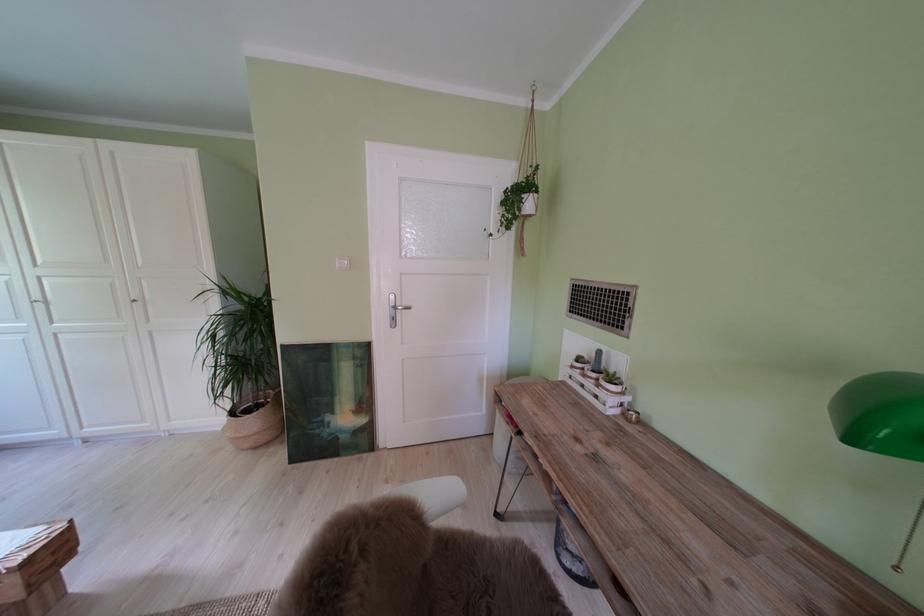
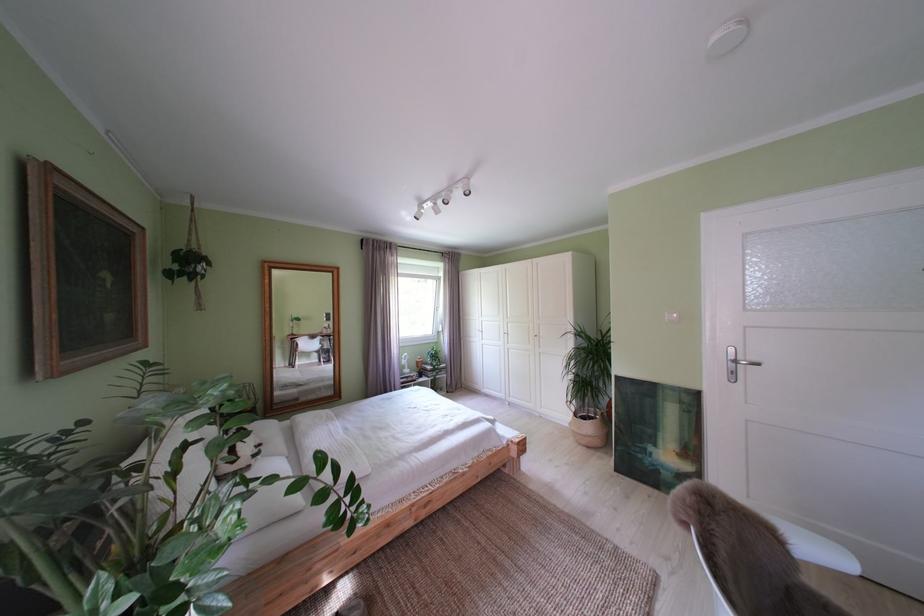
The point at [242,418] is marked in the first image. Where is the corresponding point in the second image?

(587, 419)